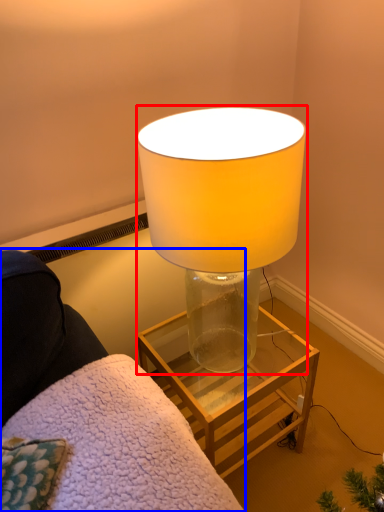
Question: Which object is further to the camera taking this photo, lamp (highlighted by a red box) or furniture (highlighted by a blue box)?

Choices:
 (A) lamp
 (B) furniture

Answer: (A)